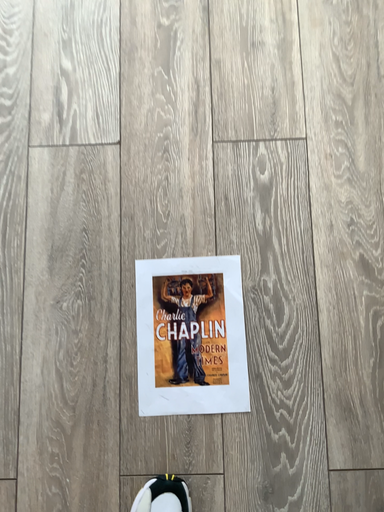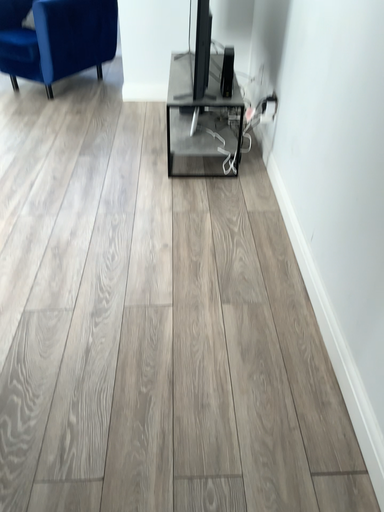
Question: How did the camera likely rotate when shooting the video?

Choices:
 (A) rotated upward
 (B) rotated downward

Answer: (A)